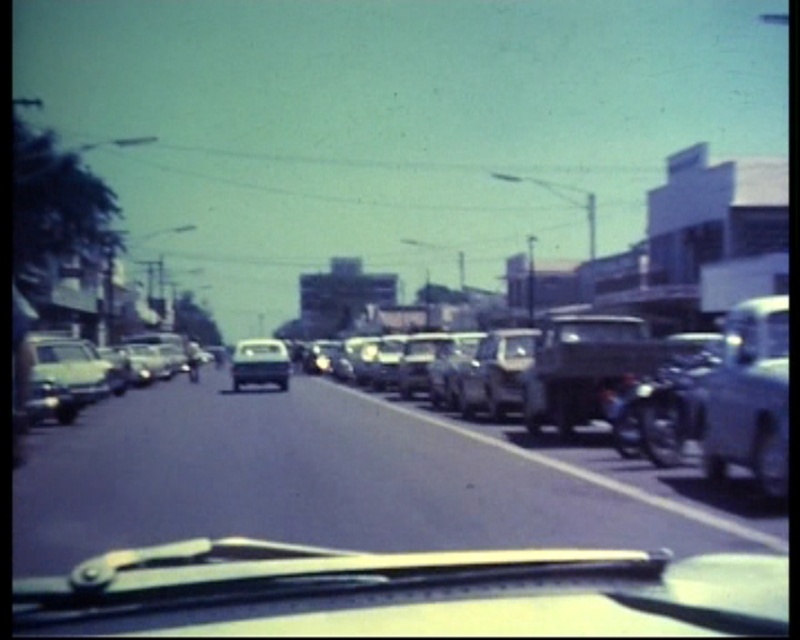
You are a delivery driver who needs to park your vehicle in a tight space between the metallic silver truck at right and the shiny silver sedan at center. Based on their sizes, which vehicle should you position your car closer to?

Since the metallic silver truck at right is larger than the shiny silver sedan at center, you should position your car closer to the shiny silver sedan at center to ensure there is enough space for parking.

You are a delivery driver who needs to park your truck in a space between two cars. You see a metallic silver truck at right and a shiny silver sedan at center. Which vehicle has a wider body to consider for parking?

The metallic silver truck at right has a wider body than the shiny silver sedan at center, so you should account for its width when parking.

You are a driver in a metallic silver car at center and want to pass the shiny silver sedan at center in front of you. Can you safely do so within the current lane?

The metallic silver car at center is smaller than the shiny silver sedan at center, so it may be able to maneuver around it in the same lane if there is enough space. However, passing in the same lane could be risky due to the size difference and potential visibility issues.